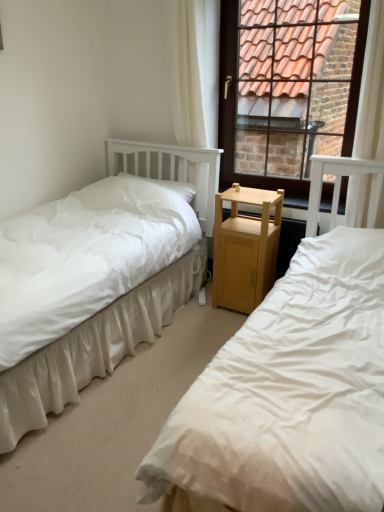
Find the location of a particular element. This screenshot has width=384, height=512. free space that is to the left of light brown wood nightstand at center is located at coordinates (200, 317).